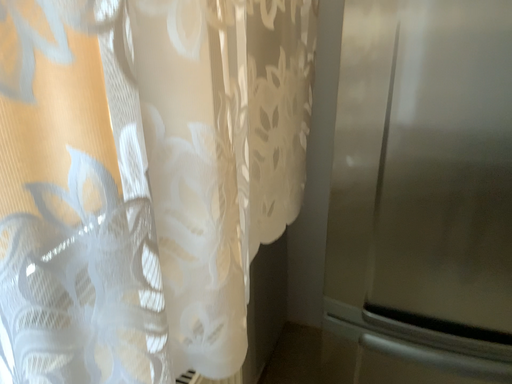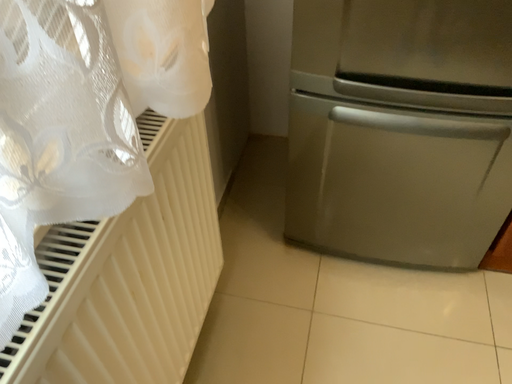
Question: How did the camera likely rotate when shooting the video?

Choices:
 (A) rotated upward
 (B) rotated downward

Answer: (B)